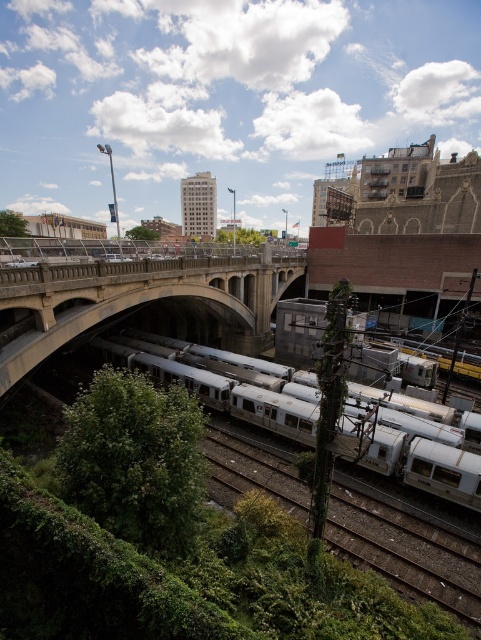
You are a pedestrian standing on the sidewalk next to the railway tracks. You see the concrete bridge at left and the white metallic train at center. Which object is located above the other?

The concrete bridge at left is positioned over the white metallic train at center, so the bridge is above the train.

You are a maintenance worker needing to access the metallic train tracks at lower center. There is a white metallic train at center blocking the path. Can you walk around the train to reach the tracks?

The metallic train tracks at lower center occupies less space than the white metallic train at center, so you can walk around the train to reach the tracks.